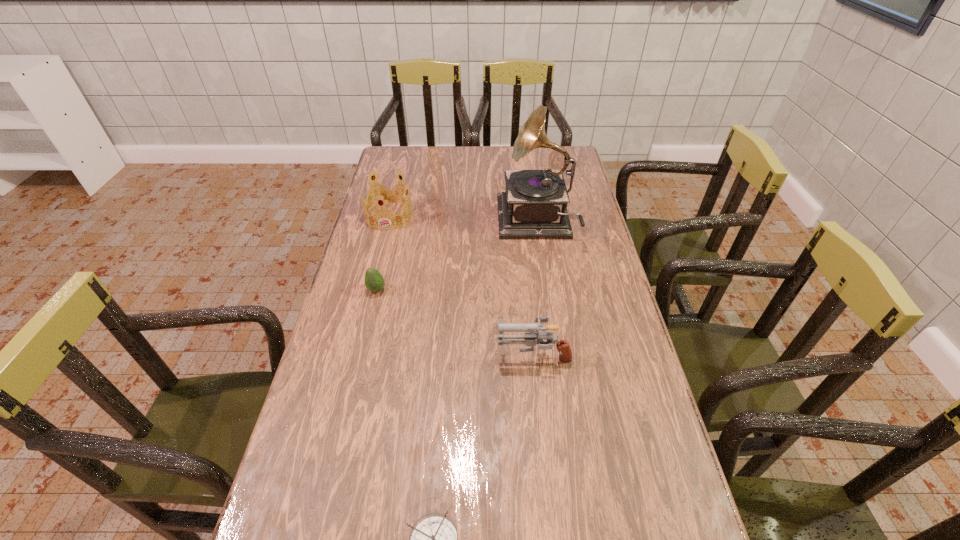
Locate an element on the screen. This screenshot has height=540, width=960. vacant space located 0.170m at the barrel end of the gun is located at coordinates (432, 354).

The image size is (960, 540). What are the coordinates of `vacant point located at the barrel end of the gun` in the screenshot? It's located at [x=375, y=354].

The height and width of the screenshot is (540, 960). What are the coordinates of `vacant space situated on the right of the avocado` in the screenshot? It's located at (498, 290).

The height and width of the screenshot is (540, 960). Find the location of `crown located at the left edge`. crown located at the left edge is located at coordinates (385, 195).

You are a GUI agent. You are given a task and a screenshot of the screen. Output one action in this format:
    pyautogui.click(x=<x>, y=<y>)
    Task: Click on the avocado positioned at the left edge
    Image resolution: width=960 pixels, height=540 pixels.
    Given the screenshot: What is the action you would take?
    pyautogui.click(x=374, y=282)

You are a GUI agent. You are given a task and a screenshot of the screen. Output one action in this format:
    pyautogui.click(x=<x>, y=<y>)
    Task: Click on the object present at the right edge
    This screenshot has height=540, width=960.
    Given the screenshot: What is the action you would take?
    pyautogui.click(x=535, y=203)

What are the coordinates of `vacant space at the far edge` in the screenshot? It's located at (466, 148).

I want to click on free location at the left edge, so click(324, 346).

Where is `vacant area at the right edge`? The width and height of the screenshot is (960, 540). vacant area at the right edge is located at coordinates (577, 222).

You are a GUI agent. You are given a task and a screenshot of the screen. Output one action in this format:
    pyautogui.click(x=<x>, y=<y>)
    Task: Click on the empty space that is in between the crown and the record player
    The height and width of the screenshot is (540, 960).
    Given the screenshot: What is the action you would take?
    pyautogui.click(x=463, y=219)